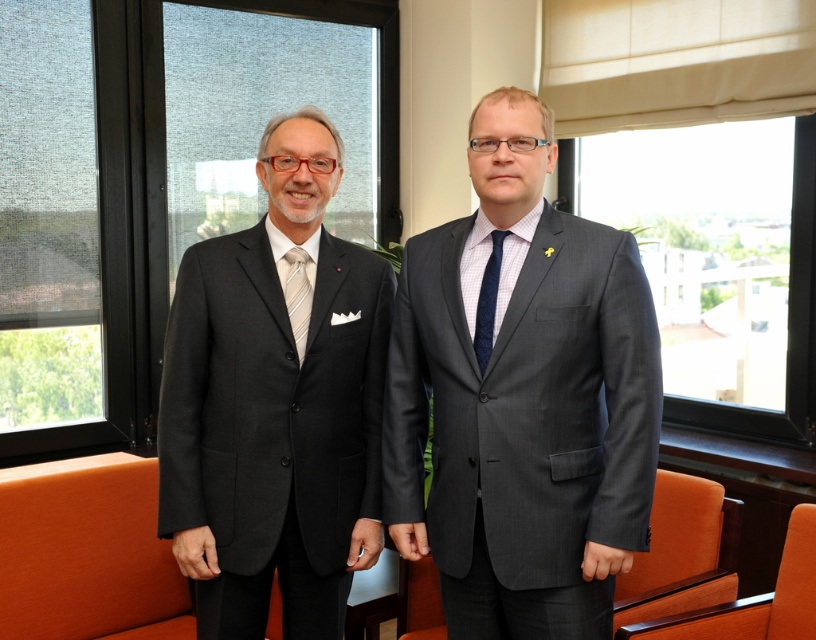
Does matte black suit at center appear on the right side of transparent glass window at upper center?

In fact, matte black suit at center is to the left of transparent glass window at upper center.

Does matte black suit at center have a larger size compared to transparent glass window at upper center?

No.

What do you see at coordinates (522, 397) in the screenshot?
I see `matte black suit at center` at bounding box center [522, 397].

Identify the location of matte black suit at center. (522, 397).

Which is behind, point (495, 547) or point (104, 40)?

Point (104, 40)

Is gray textured suit at center bigger than transparent glass window at left?

No.

You are a GUI agent. You are given a task and a screenshot of the screen. Output one action in this format:
    pyautogui.click(x=<x>, y=<y>)
    Task: Click on the gray textured suit at center
    The height and width of the screenshot is (640, 816).
    Given the screenshot: What is the action you would take?
    pyautogui.click(x=524, y=420)

Identify the location of gray textured suit at center. The height and width of the screenshot is (640, 816). (524, 420).

Can you confirm if transparent glass window at left is positioned above dark blue textured tie at center?

Correct, transparent glass window at left is located above dark blue textured tie at center.

Who is more forward, (83, 216) or (484, 352)?

Point (484, 352) is more forward.

At what (x,y) coordinates should I click in order to perform the action: click on transparent glass window at left. Please return your answer as a coordinate pair (x, y). Looking at the image, I should click on (63, 228).